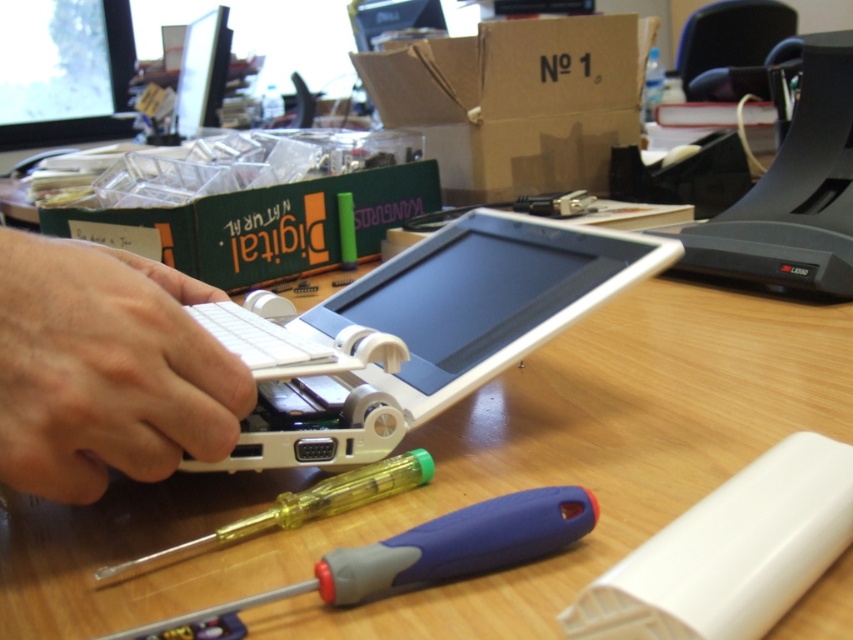
You are a technician with a 8 cm long tool. You need to place it between the white matte keyboard at left and the yellow plastic screwdriver at center without moving either object. Is there enough space?

The white matte keyboard at left and yellow plastic screwdriver at center are 7.63 centimeters apart from each other. Since your tool is 8 cm long, it would not fit between them without moving either object.

You are a technician trying to locate two specific points in the workspace. The first point is at coordinates point (x=503, y=416) and the second is at point (x=537, y=493). Which point is closer to you?

Point (x=503, y=416) is closer to you because it is further to the viewer than point (x=537, y=493).

You are setting up a workstation and need to place the white matte keyboard at left and the yellow plastic screwdriver at center. According to the image, which object is closer to you?

The white matte keyboard at left is closer to you because it is positioned over the yellow plastic screwdriver at center, indicating it is in front and thus nearer.